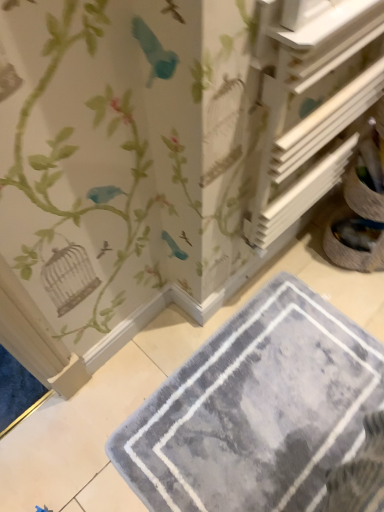
Question: In the image, is white wood shelf at upper right positioned in front of or behind gray plush bath mat at lower center?

Choices:
 (A) front
 (B) behind

Answer: (A)

Question: From a real-world perspective, is white wood shelf at upper right above or below gray plush bath mat at lower center?

Choices:
 (A) above
 (B) below

Answer: (A)

Question: In terms of height, does white wood shelf at upper right look taller or shorter compared to gray plush bath mat at lower center?

Choices:
 (A) short
 (B) tall

Answer: (B)

Question: Considering the positions of gray plush bath mat at lower center and white wood shelf at upper right in the image, is gray plush bath mat at lower center taller or shorter than white wood shelf at upper right?

Choices:
 (A) short
 (B) tall

Answer: (A)

Question: Considering the positions of gray plush bath mat at lower center and white wood shelf at upper right in the image, is gray plush bath mat at lower center bigger or smaller than white wood shelf at upper right?

Choices:
 (A) big
 (B) small

Answer: (B)

Question: Is point (321, 438) positioned closer to the camera than point (311, 178)?

Choices:
 (A) farther
 (B) closer

Answer: (A)

Question: From a real-world perspective, is gray plush bath mat at lower center positioned above or below white wood shelf at upper right?

Choices:
 (A) above
 (B) below

Answer: (B)